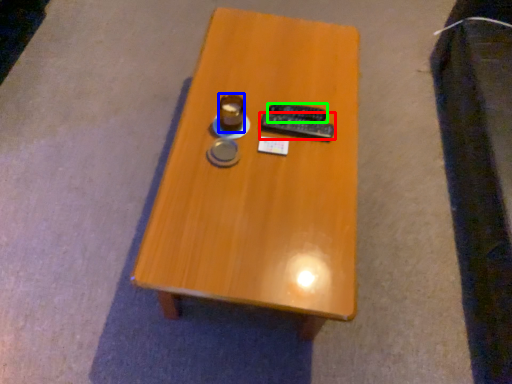
Question: Which is farther away from remote control (highlighted by a red box)? coffee cup (highlighted by a blue box) or remote control (highlighted by a green box)?

Choices:
 (A) coffee cup
 (B) remote control

Answer: (A)